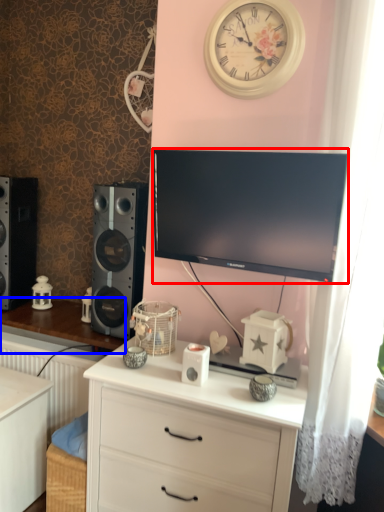
Question: Which of the following is the farthest to the observer, television (highlighted by a red box) or table (highlighted by a blue box)?

Choices:
 (A) television
 (B) table

Answer: (B)